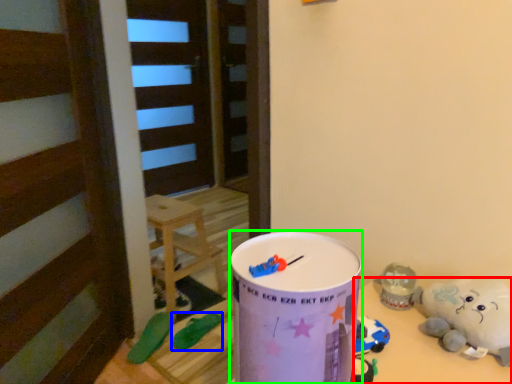
Question: Which is farther away from table (highlighted by a red box)? toy (highlighted by a blue box) or milk can (highlighted by a green box)?

Choices:
 (A) toy
 (B) milk can

Answer: (A)